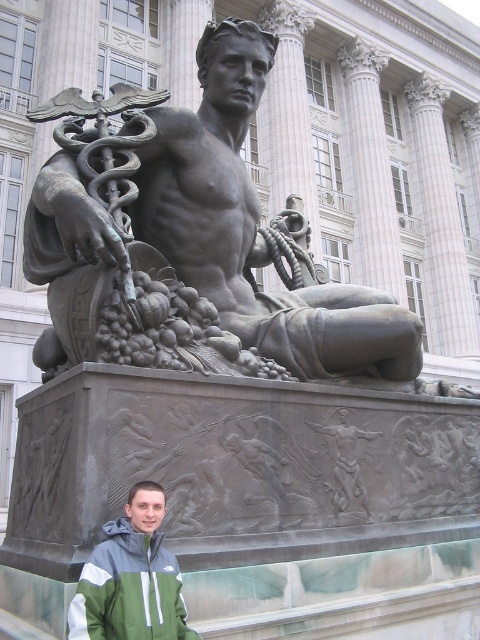
Question: Observing the image, what is the correct spatial positioning of bronze statue at center in reference to green fabric jacket at lower left?

Choices:
 (A) right
 (B) left

Answer: (A)

Question: In this image, where is bronze statue at center located relative to green fabric jacket at lower left?

Choices:
 (A) left
 (B) right

Answer: (B)

Question: Is bronze statue at center behind green fabric jacket at lower left?

Choices:
 (A) yes
 (B) no

Answer: (A)

Question: Which of the following is the farthest from the observer?

Choices:
 (A) (85, 570)
 (B) (360, 316)

Answer: (B)